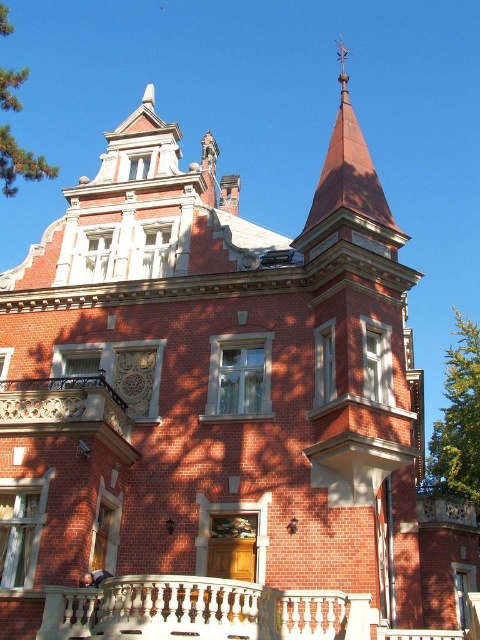
You are standing in front of the grand building and want to know if the rustic wood balcony at center is shorter than the green leafy tree at upper left. Can you confirm this based on the scene?

The rustic wood balcony at center is not as tall as green leafy tree at upper left, so yes, the balcony is shorter than the tree.

You are standing at the base of the grand building and want to take a photo of the pointed turret on the right side. The camera you are using has a focal length of 50mm and a sensor size of 36mm. If the point representing the turret is located at coordinates point (54,435), which is 121.30 feet away from you, what is the approximate angle of view required to capture the entire turret in your photo?

The point (54,435) is 121.30 feet from the camera. To calculate the angle of view, use the formula angle of view in degrees equals arctangent of sensor size divided by two multiplied by focal length multiplied by distance. Plugging in the numbers, the angle of view required is approximately 38 degrees.

You are standing 50 meters away from the grand building. A point on the building is marked at coordinates point (300, 237). Can you reach that point by walking straight towards the building from your current position?

The point (300, 237) is 46.92 meters from the viewer. Since you are standing 50 meters away, you are farther than the distance to the point, so walking straight towards the building will allow you to reach the point before reaching the building itself.